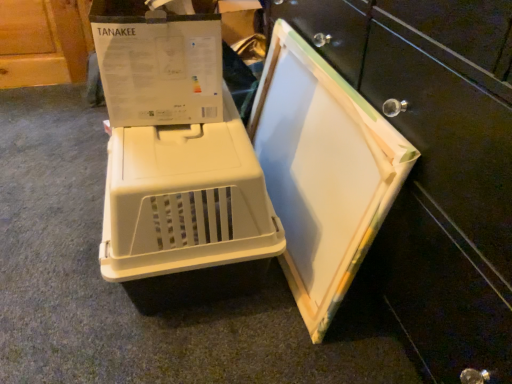
Find the location of a particular element. The height and width of the screenshot is (384, 512). blank space to the left of white cardboard at center is located at coordinates (62, 256).